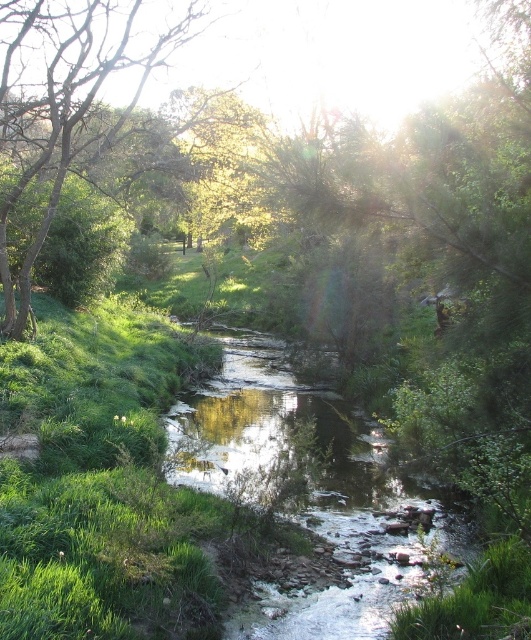
You are a hiker trying to cross the clear water stream at center. There is a green leafy tree at left nearby. Which direction should you look to find the tree while facing the stream?

The clear water stream at center is below the green leafy tree at left, so if you are facing the stream, the green leafy tree at left would be to your left side. Look to your left to find the tree.

You are a hiker who wants to cross the stream without getting your boots wet. You notice the clear water stream at center and the green leafy tree at left. Which object should you step on to cross the stream safely?

You should step on the green leafy tree at left because it is behind the clear water stream at center, so it is not part of the water and provides a solid surface to cross safely.

You are a hiker standing at the edge of the clear water stream at center. You want to take a photo of the stream with your camera. Is the stream within the camera focus range of 5 meters?

The clear water stream at center is 6.62 meters away from the camera. Since the focus range is 5 meters, the stream is beyond the focus range, so the camera cannot focus on it properly.